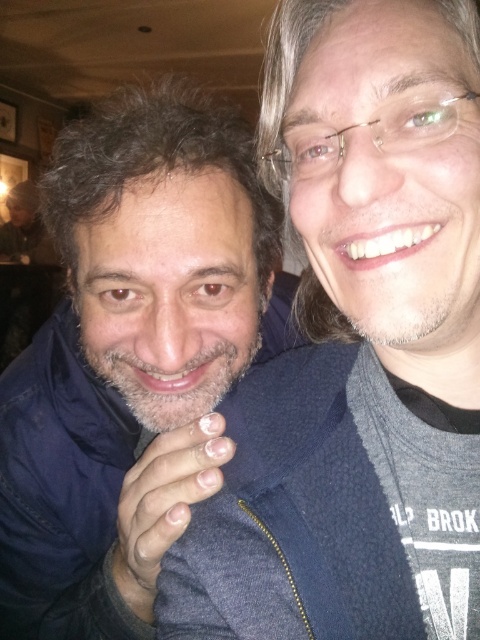
Is dark blue fleece jacket at center thinner than dark blue fleece jacket at left?

Yes.

Does dark blue fleece jacket at center have a greater height compared to dark blue fleece jacket at left?

Incorrect, dark blue fleece jacket at center's height is not larger of dark blue fleece jacket at left's.

Describe the element at coordinates (358, 348) in the screenshot. This screenshot has height=640, width=480. I see `dark blue fleece jacket at center` at that location.

In order to click on dark blue fleece jacket at center in this screenshot , I will do `click(358, 348)`.